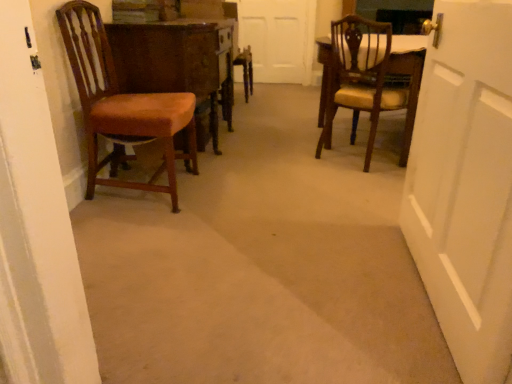
I want to click on free point to the right of matte brown chair at left, which ranks as the 1th chair in left-to-right order, so click(231, 194).